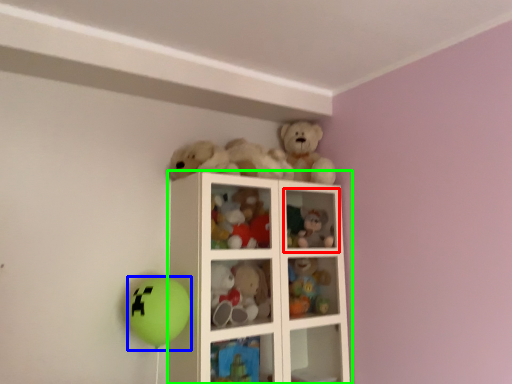
Question: Which object is positioned farthest from cabinet (highlighted by a red box)? Select from balloon (highlighted by a blue box) and shelf (highlighted by a green box).

Choices:
 (A) balloon
 (B) shelf

Answer: (A)